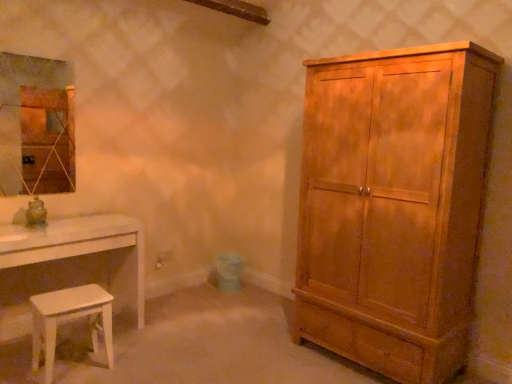
Question: Choose the correct answer: Is matte wood cabinet at right inside white glossy table at lower left or outside it?

Choices:
 (A) inside
 (B) outside

Answer: (B)

Question: Relative to white glossy table at lower left, is matte wood cabinet at right in front or behind?

Choices:
 (A) front
 (B) behind

Answer: (A)

Question: Estimate the real-world distances between objects in this image. Which object is closer to the matte wood cabinet at right?

Choices:
 (A) white glossy stool at lower left
 (B) white glossy table at lower left
 (C) matte glass mirror at upper left

Answer: (B)

Question: Estimate the real-world distances between objects in this image. Which object is closer to the white glossy stool at lower left?

Choices:
 (A) matte wood cabinet at right
 (B) white glossy table at lower left
 (C) matte glass mirror at upper left

Answer: (B)